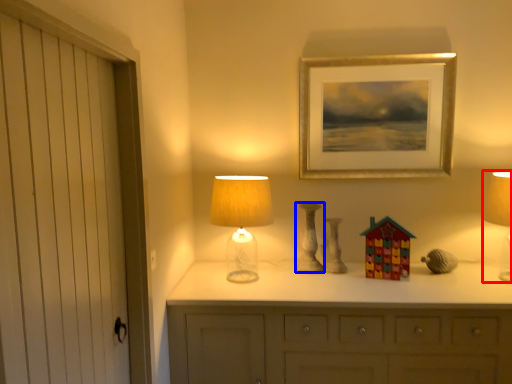
Question: Which object appears closest to the camera in this image, table lamp (highlighted by a red box) or candle holder (highlighted by a blue box)?

Choices:
 (A) table lamp
 (B) candle holder

Answer: (A)